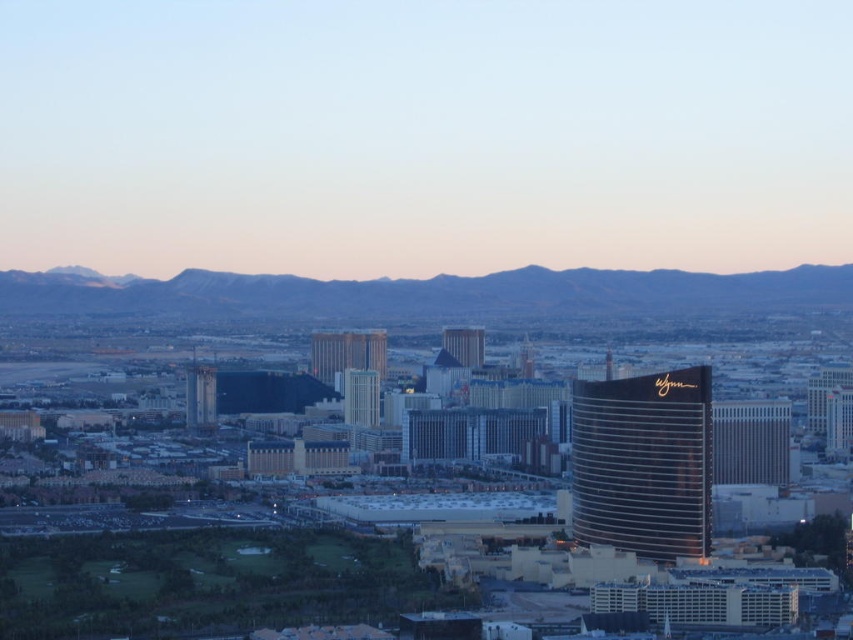
You are standing on the golf course in the foreground of the cityscape. You see two points marked in the image. Which point, point (672,433) or point (782,458), is closer to you?

Point (672,433) is closer to the viewer than point (782,458).

You are standing on the golf course in the foreground and want to take a photo of the city skyline. There are two points of interest marked as point 1 at coordinates (525, 269) and point 2 at coordinates (706, 464). Which point should you stand closer to ensure that the city buildings are more prominently featured in your photo?

You should stand closer to point 2 at coordinates (706, 464) because point 1 is in front of it, meaning point 2 is further back and closer to the city buildings, allowing them to be more prominently featured in the photo.